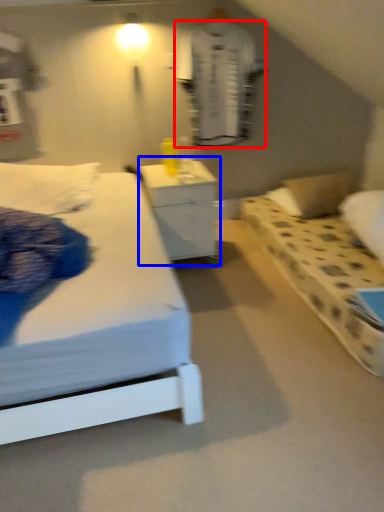
Question: Which of the following is the closest to the observer, robe (highlighted by a red box) or nightstand (highlighted by a blue box)?

Choices:
 (A) robe
 (B) nightstand

Answer: (B)